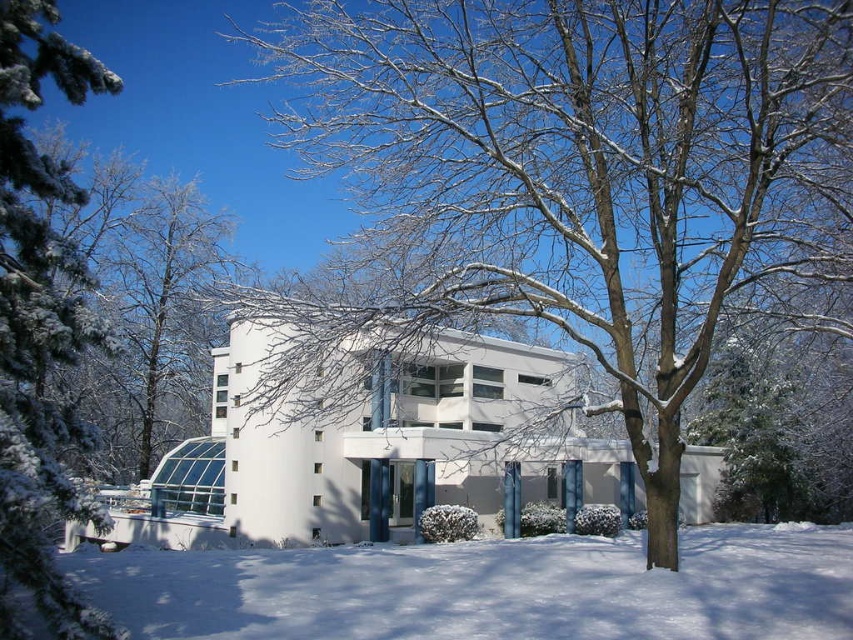
Question: Is white powdery snow at lower center to the right of snow-covered branches at left from the viewer's perspective?

Choices:
 (A) yes
 (B) no

Answer: (A)

Question: Which of these objects is positioned closest to the snow-covered tree at center?

Choices:
 (A) snow-covered branches at left
 (B) white powdery snow at lower center
 (C) green textured pine at left

Answer: (B)

Question: Which object is positioned farthest from the green textured pine at left?

Choices:
 (A) white powdery snow at lower center
 (B) snow-covered tree at center

Answer: (A)

Question: Is the position of white powdery snow at lower center less distant than that of green textured pine at left?

Choices:
 (A) yes
 (B) no

Answer: (B)

Question: Is green textured pine at left to the right of snow-covered branches at left from the viewer's perspective?

Choices:
 (A) no
 (B) yes

Answer: (B)

Question: Which of the following is the closest to the observer?

Choices:
 (A) (784, 196)
 (B) (126, 362)

Answer: (A)